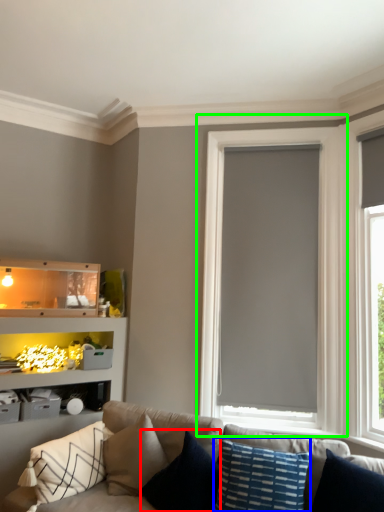
Question: Which object is positioned closest to pillow (highlighted by a red box)? Select from pillow (highlighted by a blue box) and window (highlighted by a green box).

Choices:
 (A) pillow
 (B) window

Answer: (A)